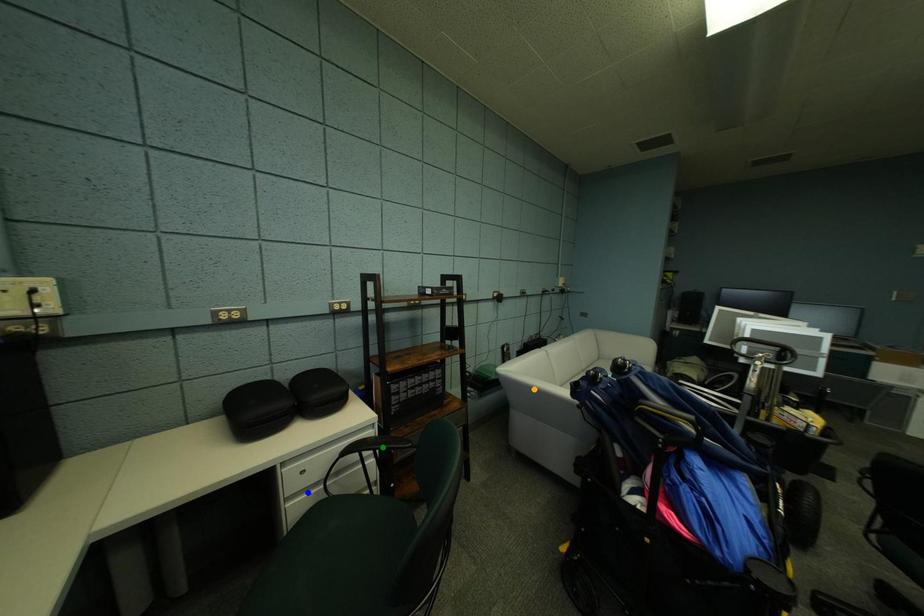
Order these from nearest to farthest:
- orange point
- green point
- blue point

orange point, green point, blue point